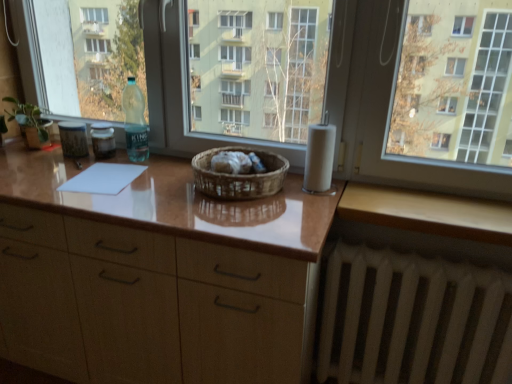
In order to face woven brown basket at center, should I rotate leftwards or rightwards?

A 2.278 degree turn to the left will do.

What is the approximate width of matte brown countertop at center?

The width of matte brown countertop at center is 24.23 inches.

Identify the location of transparent glass window at center. (385, 108).

Between translucent plastic bottle at left and transparent glass window at center, which one has smaller size?

Smaller between the two is translucent plastic bottle at left.

Is translucent plastic bottle at left positioned with its back to transparent glass window at center?

Yes, translucent plastic bottle at left's orientation is away from transparent glass window at center.

Locate an element on the screen. The image size is (512, 384). window above the translucent plastic bottle at left (from a real-world perspective) is located at coordinates (385, 108).

Which is in front, translucent plastic bottle at left or wooden at lower right?

wooden at lower right is in front.

Is translucent plastic bottle at left bigger than wooden at lower right?

No.

I want to click on counter top on the right of the translucent plastic bottle at left, so click(428, 213).

From the image's perspective, between translucent plastic bottle at left and wooden at lower right, which one is located above?

From the image's view, translucent plastic bottle at left is above.

Does white matte radiator at lower right contain woven brown basket at center?

No, woven brown basket at center is located outside of white matte radiator at lower right.

Is white matte radiator at lower right positioned far away from woven brown basket at center?

That's not correct — white matte radiator at lower right is a little close to woven brown basket at center.

Considering their positions, is white matte radiator at lower right located in front of or behind woven brown basket at center?

Visually, white matte radiator at lower right is located in front of woven brown basket at center.

Visually, is white matte radiator at lower right positioned to the left or to the right of woven brown basket at center?

Based on their positions, white matte radiator at lower right is located to the right of woven brown basket at center.

Is transparent glass window at center oriented towards green matte plant at left?

Yes, transparent glass window at center is aimed at green matte plant at left.

Considering the relative sizes of transparent glass window at center and green matte plant at left in the image provided, is transparent glass window at center bigger than green matte plant at left?

Yes, transparent glass window at center is bigger than green matte plant at left.

The image size is (512, 384). In order to click on houseplant on the left of transparent glass window at center in this screenshot , I will do `click(30, 122)`.

From a real-world perspective, which object rests below the other?

green matte plant at left, from a real-world perspective.

Image resolution: width=512 pixels, height=384 pixels. I want to click on houseplant located on the left of translucent plastic bottle at left, so click(x=30, y=122).

Is green matte plant at left behind translucent plastic bottle at left?

No, it is in front of translucent plastic bottle at left.

How much distance is there between green matte plant at left and translucent plastic bottle at left?

A distance of 11.08 inches exists between green matte plant at left and translucent plastic bottle at left.

Is matte brown countertop at center spatially inside translucent plastic bottle at left, or outside of it?

matte brown countertop at center is located beyond the bounds of translucent plastic bottle at left.

Image resolution: width=512 pixels, height=384 pixels. Find the location of `countertop located below the translucent plastic bottle at left (from the image's perspective)`. countertop located below the translucent plastic bottle at left (from the image's perspective) is located at coordinates (156, 277).

From the image's perspective, is matte brown countertop at center beneath translucent plastic bottle at left?

Indeed, from the image's perspective, matte brown countertop at center is shown beneath translucent plastic bottle at left.

Which is behind, matte brown countertop at center or translucent plastic bottle at left?

translucent plastic bottle at left is more distant.

Considering the relative positions of white matte toilet paper at right and white matte radiator at lower right in the image provided, is white matte toilet paper at right to the left of white matte radiator at lower right from the viewer's perspective?

Yes.

Is white matte toilet paper at right oriented towards white matte radiator at lower right?

No, white matte toilet paper at right is not aimed at white matte radiator at lower right.

Locate an element on the screen. The height and width of the screenshot is (384, 512). toilet paper located above the white matte radiator at lower right (from a real-world perspective) is located at coordinates (319, 157).

Between white matte toilet paper at right and white matte radiator at lower right, which one has smaller size?

white matte toilet paper at right is smaller.

Where is `bottle on the left of transparent glass window at center`? This screenshot has width=512, height=384. bottle on the left of transparent glass window at center is located at coordinates (103, 140).

What are the coordinates of `counter top below the translucent plastic bottle at left (from the image's perspective)` in the screenshot? It's located at (428, 213).

Considering their positions, is wooden at lower right positioned closer to white matte toilet paper at right than woven brown basket at center?

woven brown basket at center.

When comparing their distances from white matte toilet paper at right, does wooden at lower right or translucent plastic bottle at left seem closer?

Among the two, wooden at lower right is located nearer to white matte toilet paper at right.

Based on their spatial positions, is matte brown countertop at center or green matte plant at left closer to translucent plastic bottle at left?

The object closer to translucent plastic bottle at left is green matte plant at left.

Which object lies nearer to the anchor point matte brown countertop at center, white matte radiator at lower right or translucent plastic bottle at left?

The object closer to matte brown countertop at center is white matte radiator at lower right.

Estimate the real-world distances between objects in this image. Which object is further from translucent plastic bottle at left, green matte plant at left or wooden at lower right?

Based on the image, wooden at lower right appears to be further to translucent plastic bottle at left.

From the image, which object appears to be farther from transparent glass window at center, woven brown basket at center or green matte plant at left?

green matte plant at left is positioned further to the anchor transparent glass window at center.

Estimate the real-world distances between objects in this image. Which object is closer to wooden at lower right, white matte toilet paper at right or green matte plant at left?

white matte toilet paper at right is positioned closer to the anchor wooden at lower right.

Which object lies further to the anchor point woven brown basket at center, white matte radiator at lower right or translucent plastic bottle at left?

translucent plastic bottle at left is further to woven brown basket at center.

Where is `bottle located between green matte plant at left and transparent glass window at center in the left-right direction`? This screenshot has height=384, width=512. bottle located between green matte plant at left and transparent glass window at center in the left-right direction is located at coordinates (103, 140).

I want to click on window between green matte plant at left and wooden at lower right, so click(385, 108).

Locate an element on the screen. This screenshot has width=512, height=384. radiator between matte brown countertop at center and wooden at lower right is located at coordinates (413, 320).

Image resolution: width=512 pixels, height=384 pixels. In order to click on bottle that lies between green matte plant at left and matte brown countertop at center from top to bottom in this screenshot , I will do `click(103, 140)`.